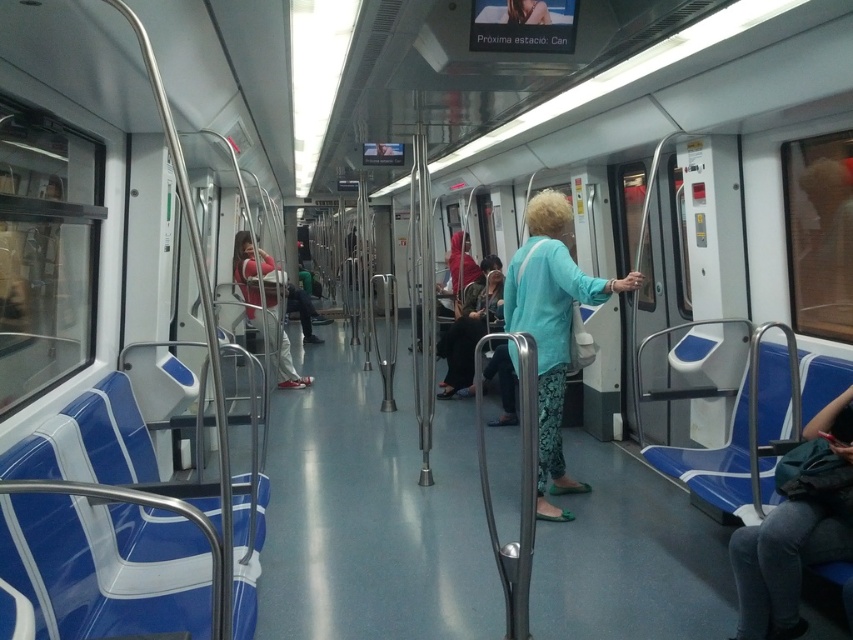
Question: Can you confirm if dark gray jeans at lower right is smaller than matte black crutches at center?

Choices:
 (A) yes
 (B) no

Answer: (A)

Question: Is light blue fabric jacket at center thinner than matte red shirt at center?

Choices:
 (A) no
 (B) yes

Answer: (B)

Question: Which point is farther to the camera?

Choices:
 (A) matte red shirt at center
 (B) dark gray jeans at lower right
 (C) matte black crutches at center

Answer: (C)

Question: Does dark gray jeans at lower right appear on the left side of matte red shirt at center?

Choices:
 (A) no
 (B) yes

Answer: (A)

Question: Which of the following is the farthest from the observer?

Choices:
 (A) light blue fabric jacket at center
 (B) matte black crutches at center

Answer: (B)

Question: Which of the following is the farthest from the observer?

Choices:
 (A) matte black crutches at center
 (B) matte red shirt at center

Answer: (A)